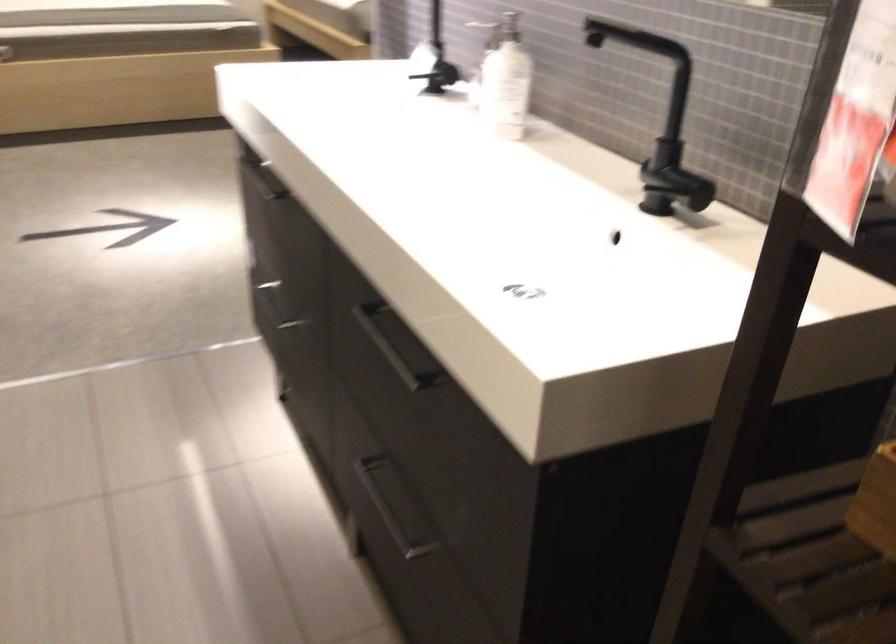
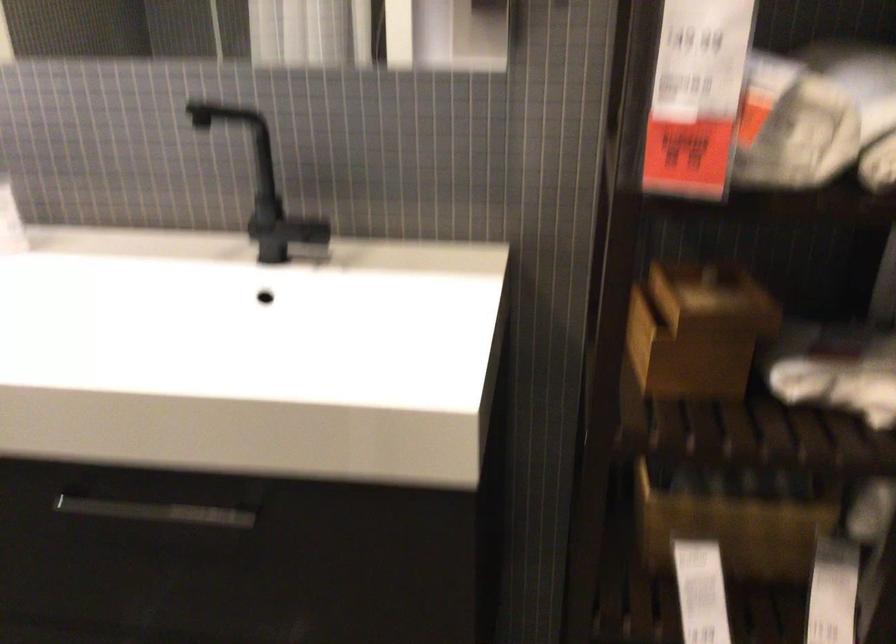
Locate, in the second image, the point that corresponds to point (399, 346) in the first image.

(152, 509)